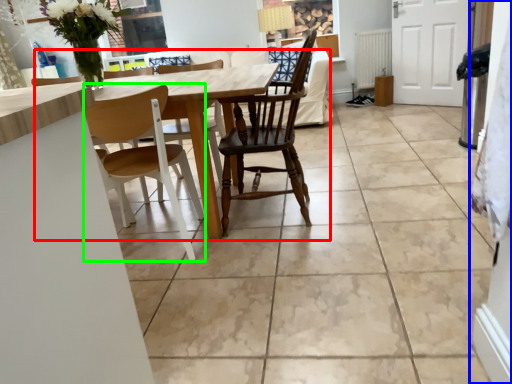
Question: Which is nearer to the kitchen & dining room table (highlighted by a red box)? side (highlighted by a blue box) or chair (highlighted by a green box).

Choices:
 (A) side
 (B) chair

Answer: (B)